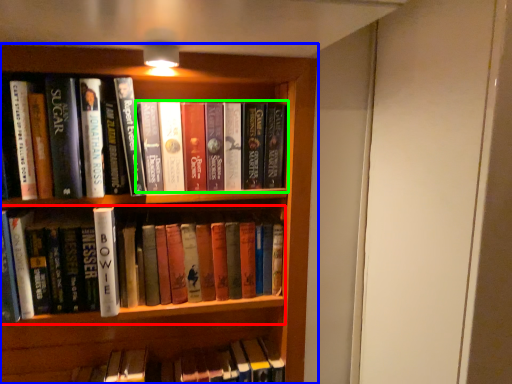
Question: Based on their relative distances, which object is farther from book (highlighted by a red box)? Choose from bookcase (highlighted by a blue box) and book (highlighted by a green box).

Choices:
 (A) bookcase
 (B) book

Answer: (A)